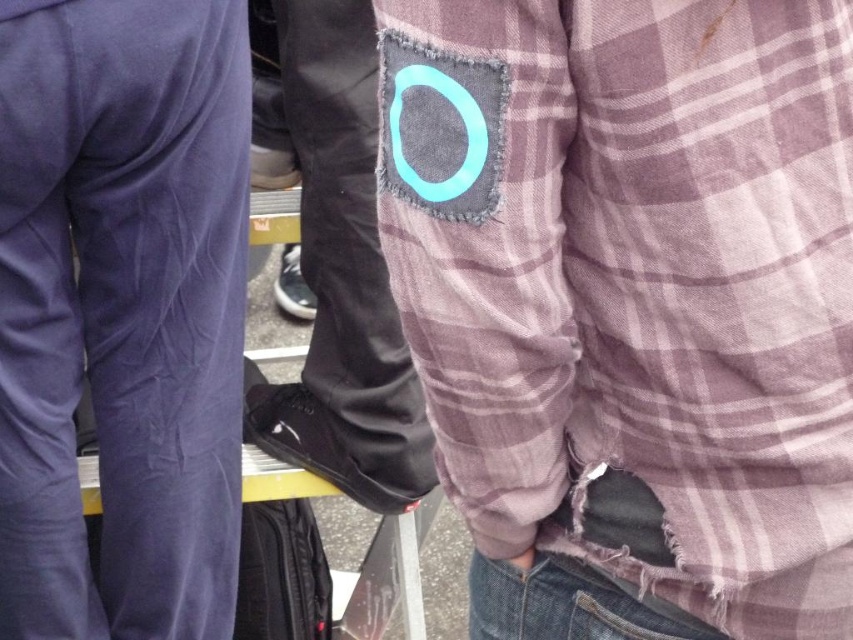
Question: Is plaid fabric at upper center below denim at lower center?

Choices:
 (A) yes
 (B) no

Answer: (B)

Question: Is plaid fabric at upper center positioned behind denim at lower center?

Choices:
 (A) yes
 (B) no

Answer: (B)

Question: Which point is farther to the camera?

Choices:
 (A) (537, 572)
 (B) (699, 525)

Answer: (A)

Question: Can you confirm if velvet purple pants at left is smaller than denim at lower center?

Choices:
 (A) yes
 (B) no

Answer: (B)

Question: Estimate the real-world distances between objects in this image. Which object is farther from the plaid fabric at upper center?

Choices:
 (A) denim at lower center
 (B) velvet purple pants at left

Answer: (B)

Question: Based on their relative distances, which object is farther from the denim at lower center?

Choices:
 (A) velvet purple pants at left
 (B) plaid fabric at upper center

Answer: (A)